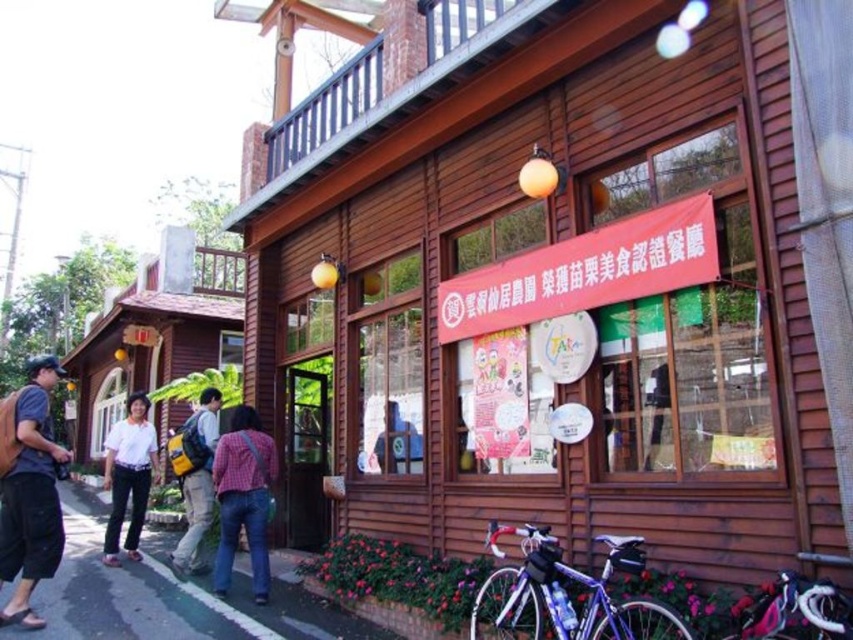
You are trying to determine if the dark blue denim shorts at lower left can fit through a doorway that is the same width as the white shirt at center. Based on their positions in the image, can they fit?

The dark blue denim shorts at lower left might be wider than the white shirt at center, so there is a possibility that they may not fit through the doorway if the shirt is used as a reference for the doorway width.

You are standing in front of the wooden building and see the dark blue denim shorts at lower left and the white shirt at center. Which object is nearer to you?

The dark blue denim shorts at lower left are closer to the viewer than the white shirt at center.